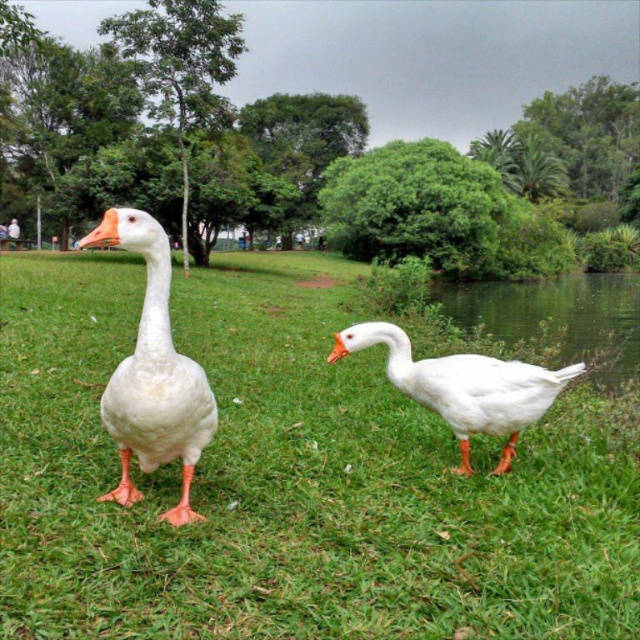
Question: Does white matte grass at center have a greater width compared to white glossy goose at center?

Choices:
 (A) no
 (B) yes

Answer: (B)

Question: Is white matte duck at center wider than white glossy goose at center?

Choices:
 (A) yes
 (B) no

Answer: (A)

Question: Can you confirm if white matte grass at center is positioned to the right of white glossy goose at center?

Choices:
 (A) yes
 (B) no

Answer: (A)

Question: Which object is positioned farthest from the white matte grass at center?

Choices:
 (A) white matte duck at center
 (B) white glossy goose at center

Answer: (B)

Question: Which object is closer to the camera taking this photo?

Choices:
 (A) white glossy goose at center
 (B) white matte goose at left
 (C) white matte grass at center

Answer: (C)

Question: Which object appears closest to the camera in this image?

Choices:
 (A) white glossy goose at center
 (B) white matte duck at center
 (C) white matte goose at left
 (D) white matte grass at center

Answer: (D)